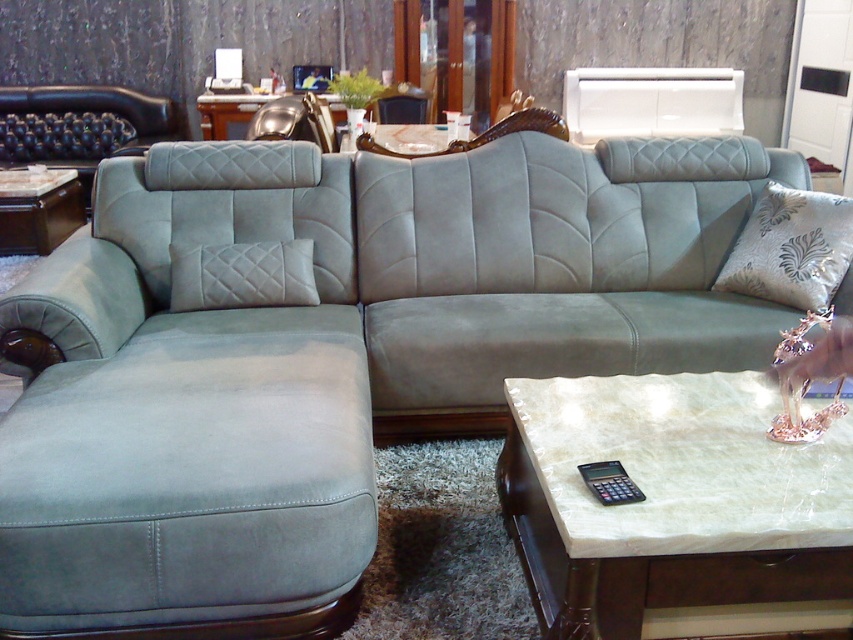
Looking at this image, does suede/velvet pillow at center lie in front of metallic gold armchair at upper center?

That is True.

Describe the element at coordinates (242, 275) in the screenshot. The width and height of the screenshot is (853, 640). I see `suede/velvet pillow at center` at that location.

Is point (206, 304) more distant than point (280, 134)?

That is False.

Where is `suede/velvet pillow at center`? The height and width of the screenshot is (640, 853). suede/velvet pillow at center is located at coordinates (242, 275).

Is silver textured pillow at right below metallic gold armchair at upper center?

Yes.

Does silver textured pillow at right have a lesser height compared to metallic gold armchair at upper center?

No.

Where is `silver textured pillow at right`? silver textured pillow at right is located at coordinates (791, 248).

Is suede/velvet pillow at center smaller than matte black side table at left?

Yes, suede/velvet pillow at center is smaller than matte black side table at left.

Between point (175, 253) and point (6, 186), which one is positioned behind?

The point (6, 186) is behind.

At what (x,y) coordinates should I click in order to perform the action: click on suede/velvet pillow at center. Please return your answer as a coordinate pair (x, y). The height and width of the screenshot is (640, 853). Looking at the image, I should click on (242, 275).

Where is `suede/velvet pillow at center`? Image resolution: width=853 pixels, height=640 pixels. suede/velvet pillow at center is located at coordinates tap(242, 275).